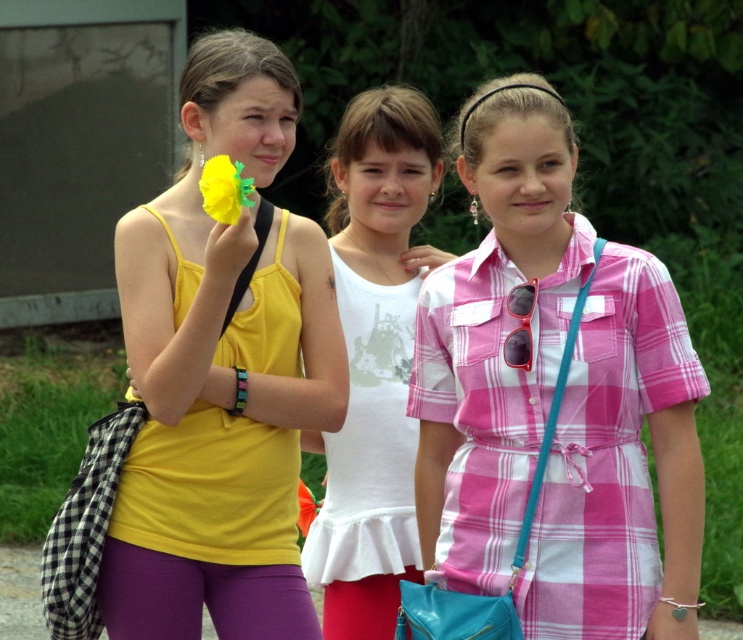
Question: In this image, where is matte yellow tank top at center located relative to white matte tank top at center?

Choices:
 (A) left
 (B) right

Answer: (A)

Question: Which of the following is the closest to the observer?

Choices:
 (A) yellow matte flower at upper center
 (B) white matte tank top at center
 (C) matte yellow tank top at center

Answer: (A)

Question: Which point is farther from the camera taking this photo?

Choices:
 (A) (357, 560)
 (B) (305, 588)

Answer: (A)

Question: Is matte yellow tank top at center wider than white matte tank top at center?

Choices:
 (A) no
 (B) yes

Answer: (B)

Question: Is matte yellow tank top at center to the left of white matte tank top at center from the viewer's perspective?

Choices:
 (A) yes
 (B) no

Answer: (A)

Question: Which point is closer to the camera taking this photo?

Choices:
 (A) click(169, 317)
 (B) click(426, 179)
 (C) click(591, 321)

Answer: (C)